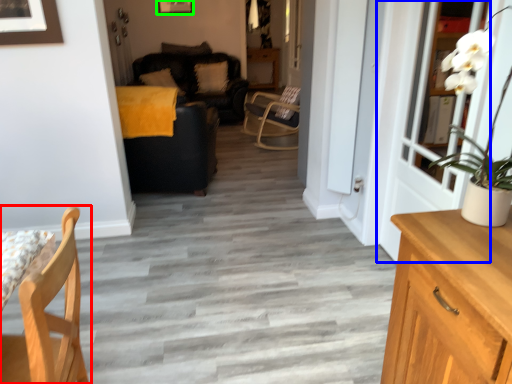
Question: Which is nearer to the chair (highlighted by a red box)? door (highlighted by a blue box) or picture frame (highlighted by a green box).

Choices:
 (A) door
 (B) picture frame

Answer: (A)